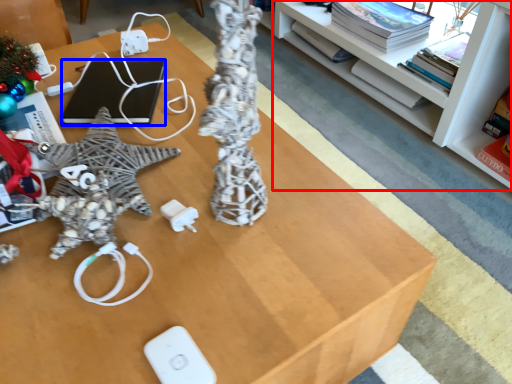
Question: Which point is further to the camera, shelf (highlighted by a red box) or laptop (highlighted by a blue box)?

Choices:
 (A) shelf
 (B) laptop

Answer: (B)